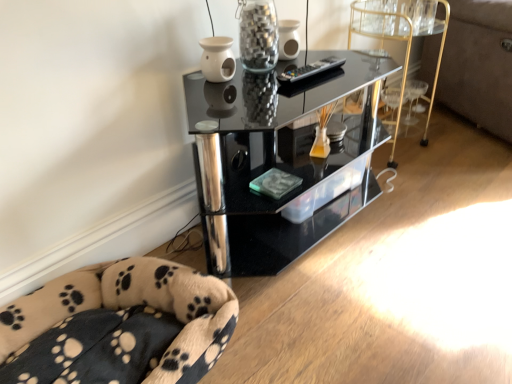
Question: From a real-world perspective, is black glass shelf at center physically located above or below gold metallic bar cart at center right?

Choices:
 (A) above
 (B) below

Answer: (B)

Question: In terms of size, does black glass shelf at center appear bigger or smaller than gold metallic bar cart at center right?

Choices:
 (A) small
 (B) big

Answer: (B)

Question: Based on their relative distances, which object is farther from the fluffy beige dog bed at lower left?

Choices:
 (A) velvet beige couch at right
 (B) black glass shelf at center
 (C) gold metallic bar cart at center right
 (D) transparent glass jar at upper center

Answer: (A)

Question: Based on their relative distances, which object is farther from the fluffy beige dog bed at lower left?

Choices:
 (A) black glass shelf at center
 (B) velvet beige couch at right
 (C) transparent glass jar at upper center
 (D) gold metallic bar cart at center right

Answer: (B)